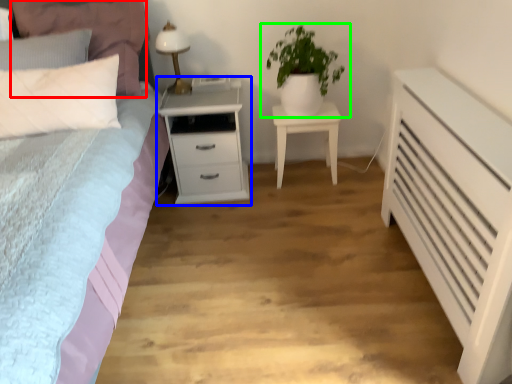
Question: Which object is positioned closest to pillow (highlighted by a red box)? Select from nightstand (highlighted by a blue box) and houseplant (highlighted by a green box).

Choices:
 (A) nightstand
 (B) houseplant

Answer: (A)